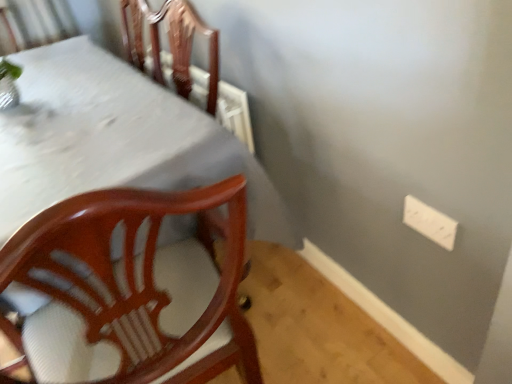
Question: Considering the positions of white plastic electric outlet at upper right and white glossy table at upper left in the image, is white plastic electric outlet at upper right wider or thinner than white glossy table at upper left?

Choices:
 (A) wide
 (B) thin

Answer: (B)

Question: Looking at the image, does white plastic electric outlet at upper right seem bigger or smaller compared to white glossy table at upper left?

Choices:
 (A) small
 (B) big

Answer: (A)

Question: Based on their positions, is white plastic electric outlet at upper right located to the left or right of white glossy table at upper left?

Choices:
 (A) left
 (B) right

Answer: (B)

Question: Considering the positions of white glossy table at upper left and white plastic electric outlet at upper right in the image, is white glossy table at upper left taller or shorter than white plastic electric outlet at upper right?

Choices:
 (A) short
 (B) tall

Answer: (B)

Question: Is white glossy table at upper left inside or outside of white plastic electric outlet at upper right?

Choices:
 (A) inside
 (B) outside

Answer: (B)

Question: In the image, is white glossy table at upper left on the left side or the right side of white plastic electric outlet at upper right?

Choices:
 (A) right
 (B) left

Answer: (B)

Question: From a real-world perspective, is white glossy table at upper left positioned above or below white plastic electric outlet at upper right?

Choices:
 (A) above
 (B) below

Answer: (B)